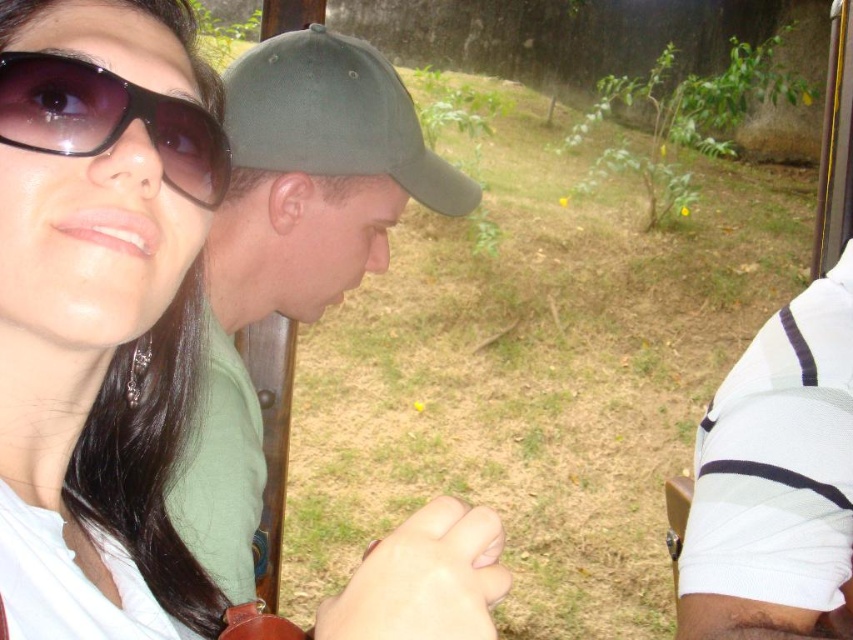
Between matte black sunglasses at upper left and black matte sunglasses at upper left, which one is positioned lower?

matte black sunglasses at upper left is lower down.

Is the position of matte black sunglasses at upper left more distant than that of black matte sunglasses at upper left?

No, it is not.

Which is in front, point (193, 272) or point (155, 136)?

Point (155, 136) is more forward.

Identify the location of matte black sunglasses at upper left. The height and width of the screenshot is (640, 853). (148, 456).

Can you confirm if white striped shirt at right is bigger than matte black sunglasses at upper left?

Indeed, white striped shirt at right has a larger size compared to matte black sunglasses at upper left.

Between point (717, 468) and point (160, 454), which one is positioned in front?

Point (160, 454) is in front.

Who is more distant from viewer, (785, 442) or (172, 324)?

The point (785, 442) is behind.

This screenshot has width=853, height=640. What are the coordinates of `white striped shirt at right` in the screenshot? It's located at (776, 481).

Is white striped shirt at right closer to camera compared to green matte baseball cap at center?

No, it is behind green matte baseball cap at center.

Can you confirm if white striped shirt at right is thinner than green matte baseball cap at center?

Incorrect, white striped shirt at right's width is not less than green matte baseball cap at center's.

Which is behind, point (795, 314) or point (242, 97)?

The point (795, 314) is more distant.

Find the location of a particular element. The image size is (853, 640). white striped shirt at right is located at coordinates (776, 481).